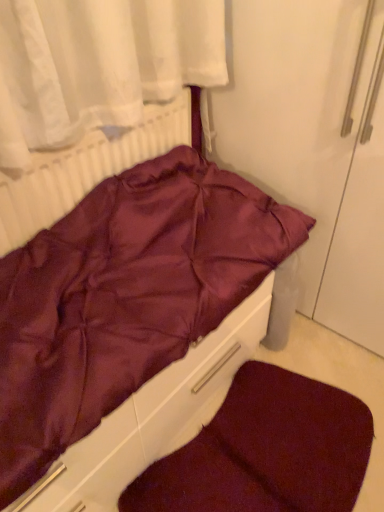
Question: Considering the relative sizes of white textured radiator at upper left and burgundy plush dog bed at lower center in the image provided, is white textured radiator at upper left thinner than burgundy plush dog bed at lower center?

Choices:
 (A) no
 (B) yes

Answer: (B)

Question: Is white textured radiator at upper left taller than burgundy plush dog bed at lower center?

Choices:
 (A) yes
 (B) no

Answer: (A)

Question: Can you confirm if white textured radiator at upper left is wider than burgundy plush dog bed at lower center?

Choices:
 (A) no
 (B) yes

Answer: (A)

Question: Can you confirm if white textured radiator at upper left is bigger than burgundy plush dog bed at lower center?

Choices:
 (A) no
 (B) yes

Answer: (B)

Question: From a real-world perspective, is white textured radiator at upper left on burgundy plush dog bed at lower center?

Choices:
 (A) yes
 (B) no

Answer: (A)

Question: Are white textured radiator at upper left and burgundy plush dog bed at lower center making contact?

Choices:
 (A) no
 (B) yes

Answer: (A)

Question: Is burgundy plush dog bed at lower center wider than white textured radiator at upper left?

Choices:
 (A) yes
 (B) no

Answer: (A)

Question: Is burgundy plush dog bed at lower center taller than white textured radiator at upper left?

Choices:
 (A) yes
 (B) no

Answer: (B)

Question: Is burgundy plush dog bed at lower center smaller than white textured radiator at upper left?

Choices:
 (A) no
 (B) yes

Answer: (B)

Question: Is burgundy plush dog bed at lower center not close to white textured radiator at upper left?

Choices:
 (A) yes
 (B) no

Answer: (B)

Question: Is burgundy plush dog bed at lower center oriented towards white textured radiator at upper left?

Choices:
 (A) no
 (B) yes

Answer: (A)

Question: Is burgundy plush dog bed at lower center thinner than white textured radiator at upper left?

Choices:
 (A) no
 (B) yes

Answer: (A)

Question: Is white textured radiator at upper left inside burgundy satin bed at center?

Choices:
 (A) yes
 (B) no

Answer: (B)